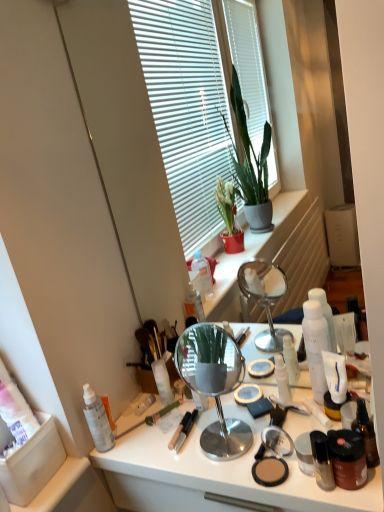
Question: Is shiny black bottle at lower right, the 4th toiletry viewed from the right, thinner than white glossy lotion at center, placed as the fifth toiletry when sorted from right to left?

Choices:
 (A) no
 (B) yes

Answer: (A)

Question: Considering the relative sizes of shiny black bottle at lower right, the 4th toiletry viewed from the right, and white glossy lotion at center, placed as the third toiletry when sorted from left to right, in the image provided, is shiny black bottle at lower right, the 4th toiletry viewed from the right, smaller than white glossy lotion at center, placed as the third toiletry when sorted from left to right,?

Choices:
 (A) no
 (B) yes

Answer: (A)

Question: From a real-world perspective, is shiny black bottle at lower right, which is counted as the fourth toiletry, starting from the left, located higher than white glossy lotion at center, placed as the third toiletry when sorted from left to right?

Choices:
 (A) yes
 (B) no

Answer: (B)

Question: Is shiny black bottle at lower right, the 4th toiletry viewed from the right, aimed at white glossy lotion at center, placed as the fifth toiletry when sorted from right to left?

Choices:
 (A) no
 (B) yes

Answer: (A)

Question: Is shiny black bottle at lower right, which is counted as the fourth toiletry, starting from the left, positioned behind white glossy lotion at center, placed as the third toiletry when sorted from left to right?

Choices:
 (A) no
 (B) yes

Answer: (A)

Question: Is green plastic paint brush at lower left in front of or behind shiny brown bottle at right, the 7th toiletry positioned from the left, in the image?

Choices:
 (A) front
 (B) behind

Answer: (B)

Question: Considering the positions of green plastic paint brush at lower left and shiny brown bottle at right, which is the first toiletry from right to left, in the image, is green plastic paint brush at lower left taller or shorter than shiny brown bottle at right, which is the first toiletry from right to left,?

Choices:
 (A) tall
 (B) short

Answer: (B)

Question: Based on their sizes in the image, would you say green plastic paint brush at lower left is bigger or smaller than shiny brown bottle at right, which is the first toiletry from right to left?

Choices:
 (A) big
 (B) small

Answer: (B)

Question: In terms of width, does green plastic paint brush at lower left look wider or thinner when compared to shiny brown bottle at right, the 7th toiletry positioned from the left?

Choices:
 (A) wide
 (B) thin

Answer: (A)

Question: Is polished silver mirror at center bigger or smaller than matte brown jar at lower right, which appears as the 6th toiletry when viewed from the left?

Choices:
 (A) small
 (B) big

Answer: (B)

Question: From a real-world perspective, relative to matte brown jar at lower right, which appears as the 6th toiletry when viewed from the left, is polished silver mirror at center vertically above or below?

Choices:
 (A) below
 (B) above

Answer: (B)

Question: Is point (215, 406) closer or farther from the camera than point (329, 444)?

Choices:
 (A) closer
 (B) farther

Answer: (B)

Question: In terms of height, does polished silver mirror at center look taller or shorter compared to matte brown jar at lower right, marked as the second toiletry in a right-to-left arrangement?

Choices:
 (A) tall
 (B) short

Answer: (A)

Question: From their relative heights in the image, would you say polished silver mirror at center is taller or shorter than white glossy lotion at center, placed as the fifth toiletry when sorted from right to left?

Choices:
 (A) short
 (B) tall

Answer: (B)

Question: Considering the positions of point (215, 378) and point (281, 398), is point (215, 378) closer or farther from the camera than point (281, 398)?

Choices:
 (A) closer
 (B) farther

Answer: (B)